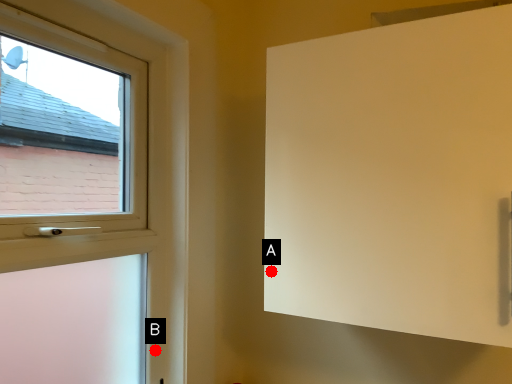
Question: Two points are circled on the image, labeled by A and B beside each circle. Which of the following is the farthest from the observer?

Choices:
 (A) A is further
 (B) B is further

Answer: (B)